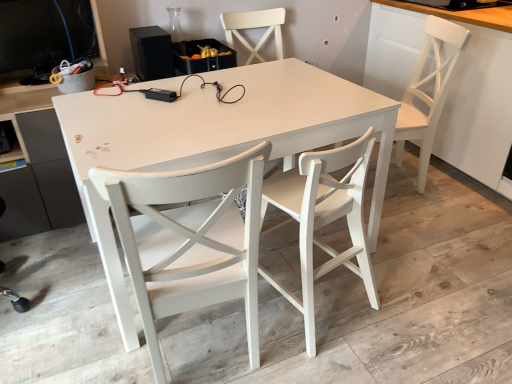
Question: Does matte black desktop computer at upper left turn towards white wood chair at center, the 2th chair from the left?

Choices:
 (A) yes
 (B) no

Answer: (A)

Question: Can you confirm if matte black desktop computer at upper left is shorter than white wood chair at center, the second chair positioned from the right?

Choices:
 (A) no
 (B) yes

Answer: (B)

Question: Does matte black desktop computer at upper left have a lesser width compared to white wood chair at center, the second chair positioned from the right?

Choices:
 (A) yes
 (B) no

Answer: (A)

Question: Is matte black desktop computer at upper left closer to camera compared to white wood chair at center, the second chair positioned from the right?

Choices:
 (A) no
 (B) yes

Answer: (A)

Question: Would you say matte black desktop computer at upper left is a long distance from white wood chair at center, the second chair positioned from the right?

Choices:
 (A) yes
 (B) no

Answer: (A)

Question: Can you confirm if matte black desktop computer at upper left is smaller than white wood chair at center, the second chair positioned from the right?

Choices:
 (A) yes
 (B) no

Answer: (A)

Question: Is white wood chair at center, the second chair positioned from the right, to the right of white matte table at center from the viewer's perspective?

Choices:
 (A) no
 (B) yes

Answer: (B)

Question: Would you say white matte table at center is part of white wood chair at center, the 2th chair from the left,'s contents?

Choices:
 (A) yes
 (B) no

Answer: (B)

Question: Is white wood chair at center, the 2th chair from the left, in contact with white matte table at center?

Choices:
 (A) no
 (B) yes

Answer: (A)

Question: Can we say white wood chair at center, the second chair positioned from the right, lies outside white matte table at center?

Choices:
 (A) yes
 (B) no

Answer: (B)

Question: From a real-world perspective, is white wood chair at center, the second chair positioned from the right, on white matte table at center?

Choices:
 (A) yes
 (B) no

Answer: (A)

Question: Does white wood chair at center, the 2th chair from the left, have a greater height compared to white matte table at center?

Choices:
 (A) no
 (B) yes

Answer: (B)

Question: Does white painted wood chair at center, placed as the first chair when sorted from left to right, have a lesser height compared to white matte table at center?

Choices:
 (A) yes
 (B) no

Answer: (B)